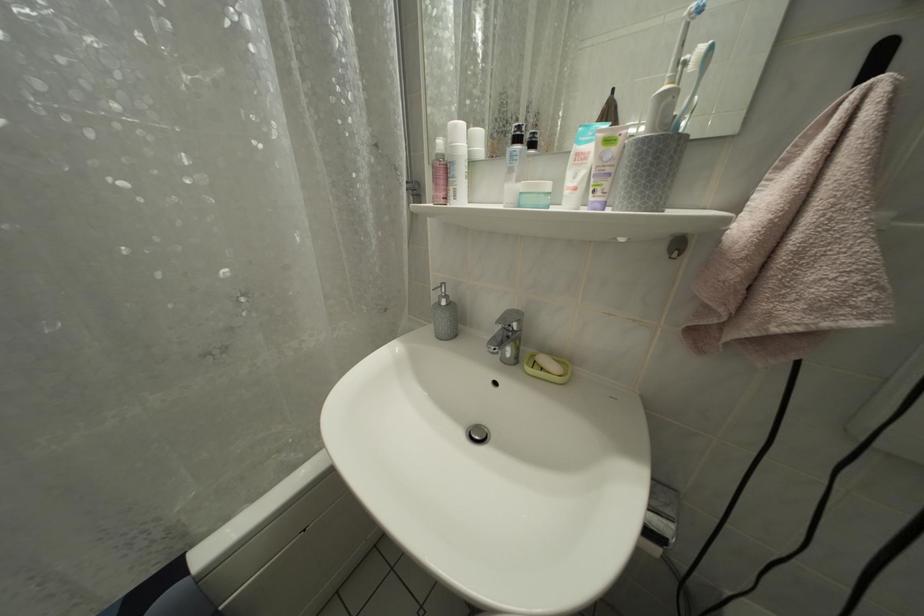
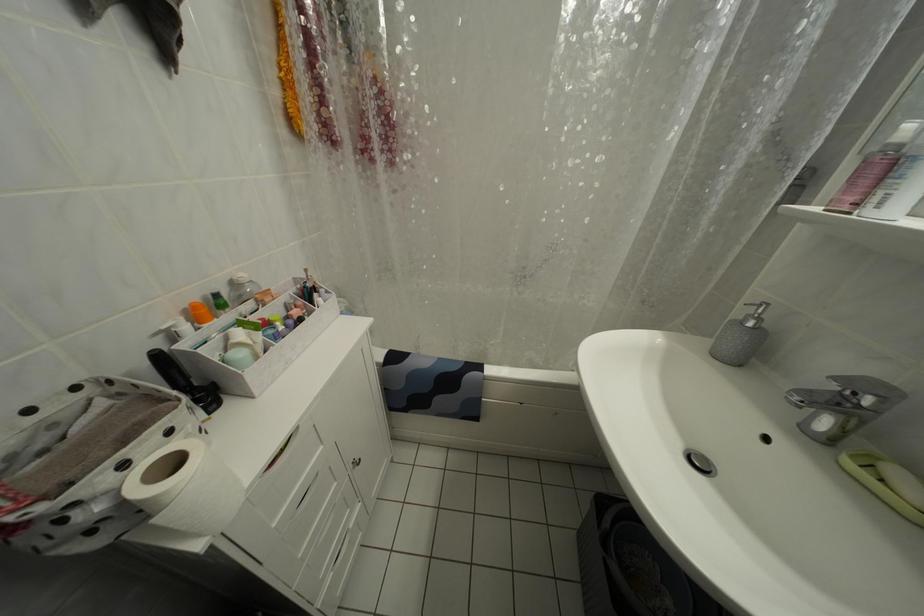
The images are taken continuously from a first-person perspective. In which direction is your viewpoint rotating?

The rotation direction of the camera is left-down.